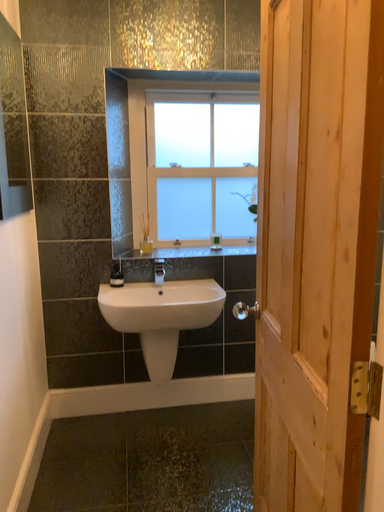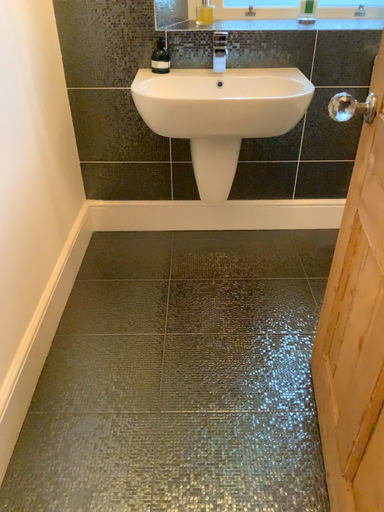
Question: How did the camera likely rotate when shooting the video?

Choices:
 (A) rotated upward
 (B) rotated downward

Answer: (B)